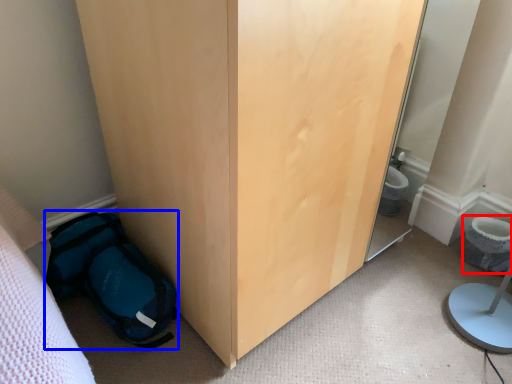
Question: Which point is closer to the camera, toilet bowl (highlighted by a red box) or backpack (highlighted by a blue box)?

Choices:
 (A) toilet bowl
 (B) backpack

Answer: (B)